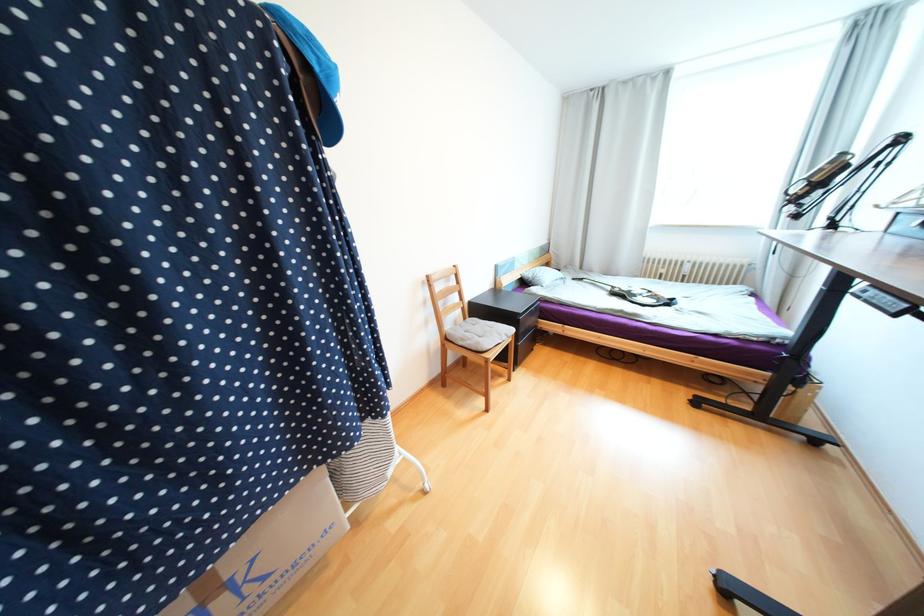
Find where to lift the grey pillow. Please return your answer as a coordinate pair (x, y).

(541, 276)